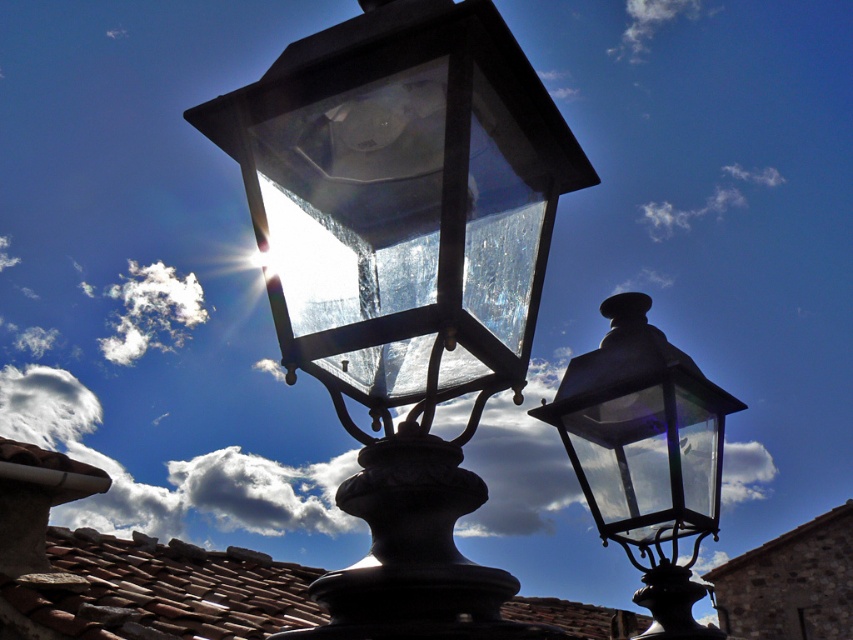
From the picture: Is matte glass lantern at center positioned behind matte glass lamp at right?

That is False.

At what (x,y) coordinates should I click in order to perform the action: click on matte glass lantern at center. Please return your answer as a coordinate pair (x, y). Looking at the image, I should click on (404, 275).

I want to click on matte glass lantern at center, so click(404, 275).